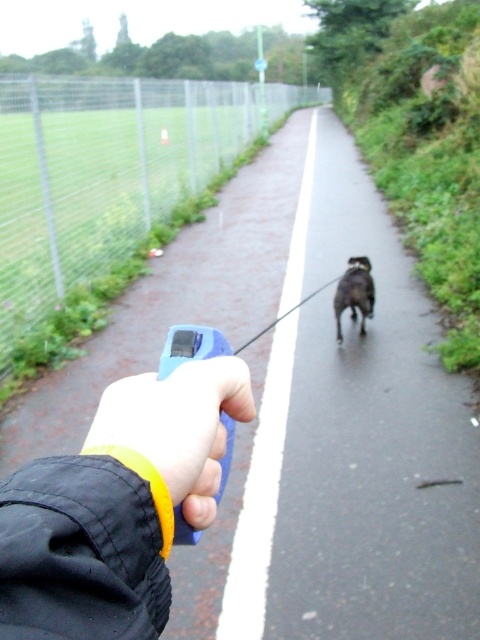
Who is more distant from viewer, (97,160) or (217,392)?

The point (97,160) is behind.

At what (x,y) coordinates should I click in order to perform the action: click on metal fence at left. Please return your answer as a coordinate pair (x, y). The width and height of the screenshot is (480, 640). Looking at the image, I should click on (109, 173).

Does black rubber leash at center appear on the right side of black fabric wristband at lower left?

Yes, black rubber leash at center is to the right of black fabric wristband at lower left.

Can you confirm if black rubber leash at center is shorter than black fabric wristband at lower left?

Incorrect, black rubber leash at center's height does not fall short of black fabric wristband at lower left's.

I want to click on black rubber leash at center, so (x=355, y=444).

Looking at this image, does yellow rubber wristband at lower center have a greater height compared to shiny black dog at center?

In fact, yellow rubber wristband at lower center may be shorter than shiny black dog at center.

Does yellow rubber wristband at lower center lie in front of shiny black dog at center?

Yes, yellow rubber wristband at lower center is closer to the viewer.

Between point (132, 419) and point (357, 264), which one is positioned in front?

Point (132, 419) is more forward.

I want to click on yellow rubber wristband at lower center, so click(x=178, y=426).